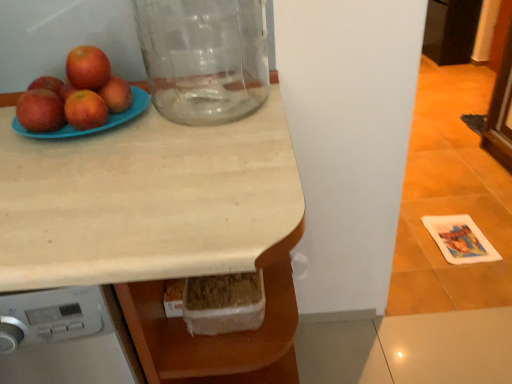
Image resolution: width=512 pixels, height=384 pixels. I want to click on vacant space underneath transparent glass jar at upper left (from a real-world perspective), so click(x=209, y=103).